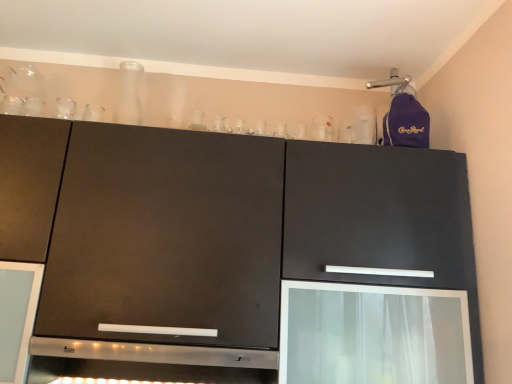
Question: From a real-world perspective, is satin silver exhaust hood at center above or below transparent glass screen door at lower right?

Choices:
 (A) above
 (B) below

Answer: (B)

Question: Considering the relative positions of satin silver exhaust hood at center and transparent glass screen door at lower right in the image provided, is satin silver exhaust hood at center to the left or to the right of transparent glass screen door at lower right?

Choices:
 (A) left
 (B) right

Answer: (A)

Question: Estimate the real-world distances between objects in this image. Which object is closer to the transparent glass carafe at upper center?

Choices:
 (A) matte black cabinet at upper center
 (B) transparent glass screen door at lower right
 (C) satin silver exhaust hood at center

Answer: (A)

Question: Based on their relative distances, which object is nearer to the transparent glass screen door at lower right?

Choices:
 (A) transparent glass carafe at upper center
 (B) satin silver exhaust hood at center
 (C) matte black cabinet at upper center

Answer: (C)